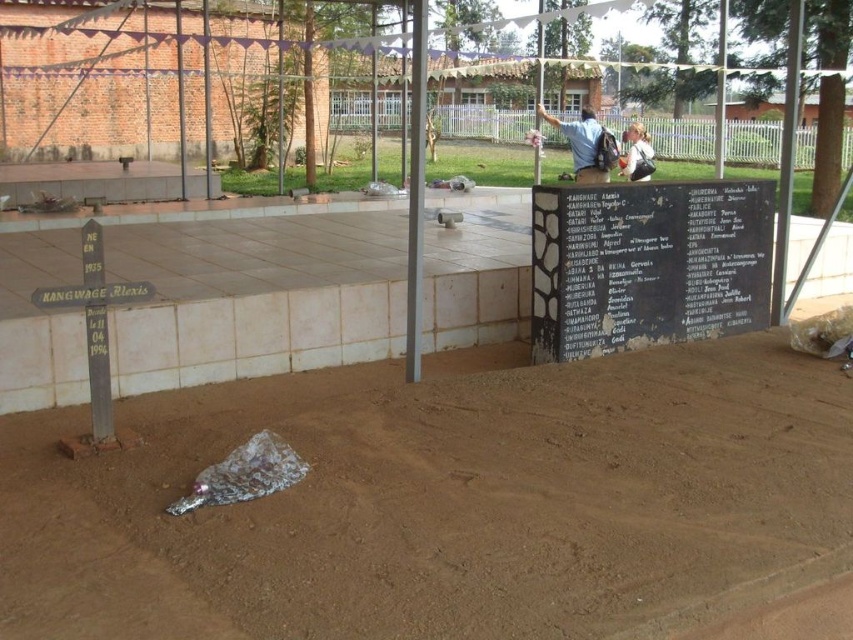
Question: Which point is closer to the camera?

Choices:
 (A) brown dirt track at center
 (B) light brown leather backpack at upper center

Answer: (A)

Question: Does brown dirt track at center have a lesser width compared to light brown leather backpack at upper center?

Choices:
 (A) yes
 (B) no

Answer: (B)

Question: In this image, where is brown dirt track at center located relative to blue fabric backpack at upper center?

Choices:
 (A) below
 (B) above

Answer: (A)

Question: Does brown dirt track at center have a greater width compared to blue fabric backpack at upper center?

Choices:
 (A) no
 (B) yes

Answer: (B)

Question: Which is farther from the blue fabric backpack at upper center?

Choices:
 (A) brown dirt track at center
 (B) light brown leather backpack at upper center

Answer: (A)

Question: Which object appears farthest from the camera in this image?

Choices:
 (A) brown dirt track at center
 (B) blue fabric backpack at upper center
 (C) light brown leather backpack at upper center

Answer: (C)